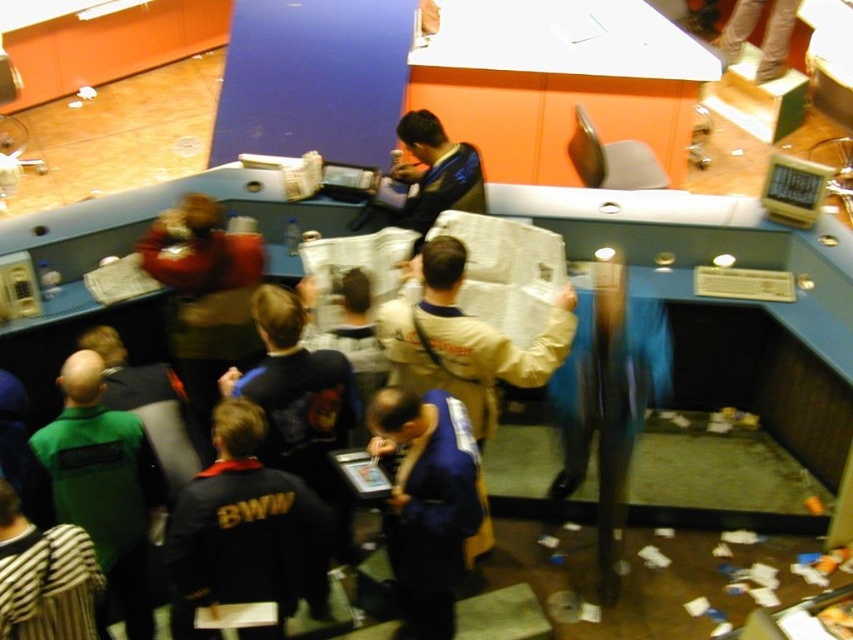
Consider the image. You are a photographer at the event and want to capture both the blue fabric shirt at center and the khaki fabric jacket at center in a single frame. Which one should you focus on first to ensure both are in the shot?

The blue fabric shirt at center is positioned on the left side of khaki fabric jacket at center, so focusing on the khaki fabric jacket at center first will ensure both are included in the frame as the blue fabric shirt at center is to its left.